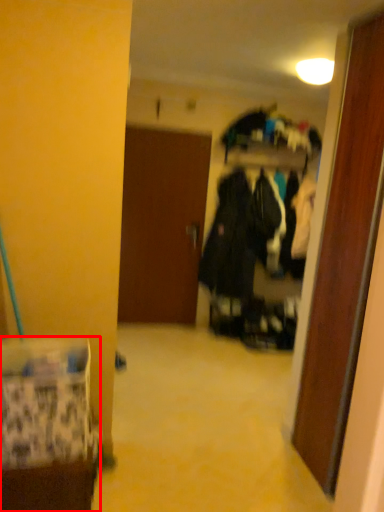
Question: Where is furniture (annotated by the red box) located in relation to door in the image?

Choices:
 (A) right
 (B) left

Answer: (B)